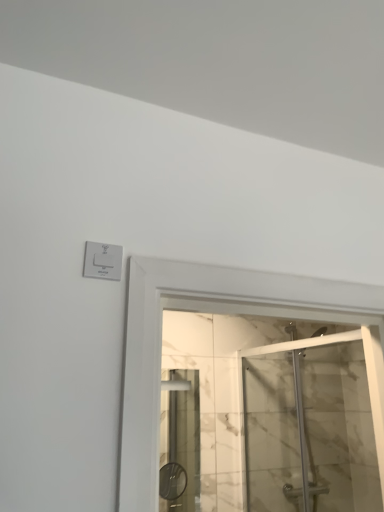
Question: Is transparent glass shower door at center shorter than white plastic switch at upper left?

Choices:
 (A) yes
 (B) no

Answer: (B)

Question: From a real-world perspective, is transparent glass shower door at center under white plastic switch at upper left?

Choices:
 (A) yes
 (B) no

Answer: (A)

Question: From a real-world perspective, is transparent glass shower door at center positioned over white plastic switch at upper left based on gravity?

Choices:
 (A) no
 (B) yes

Answer: (A)

Question: Considering the relative sizes of transparent glass shower door at center and white plastic switch at upper left in the image provided, is transparent glass shower door at center bigger than white plastic switch at upper left?

Choices:
 (A) no
 (B) yes

Answer: (B)

Question: Does transparent glass shower door at center have a greater width compared to white plastic switch at upper left?

Choices:
 (A) yes
 (B) no

Answer: (A)

Question: Is transparent glass shower door at center positioned behind white plastic switch at upper left?

Choices:
 (A) yes
 (B) no

Answer: (A)

Question: From the image's perspective, is white plastic switch at upper left on transparent glass shower door at center?

Choices:
 (A) yes
 (B) no

Answer: (A)

Question: Does white plastic switch at upper left have a smaller size compared to transparent glass shower door at center?

Choices:
 (A) no
 (B) yes

Answer: (B)

Question: Does white plastic switch at upper left have a lesser height compared to transparent glass shower door at center?

Choices:
 (A) no
 (B) yes

Answer: (B)

Question: Does white plastic switch at upper left come behind transparent glass shower door at center?

Choices:
 (A) yes
 (B) no

Answer: (B)

Question: From a real-world perspective, is white plastic switch at upper left physically below transparent glass shower door at center?

Choices:
 (A) no
 (B) yes

Answer: (A)

Question: Is the depth of white plastic switch at upper left less than that of transparent glass shower door at center?

Choices:
 (A) yes
 (B) no

Answer: (A)

Question: Considering their positions, is white plastic switch at upper left located in front of or behind transparent glass shower door at center?

Choices:
 (A) behind
 (B) front

Answer: (B)